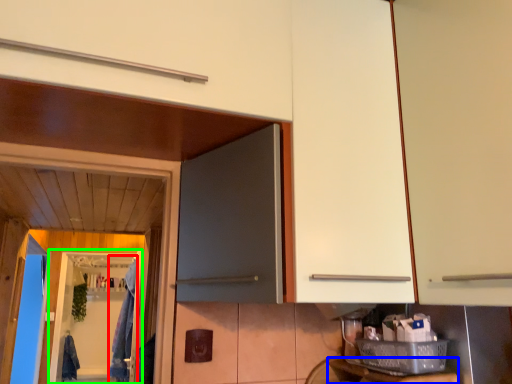
Question: Based on their relative distances, which object is farther from laundry (highlighted by a red box)? Choose from counter top (highlighted by a blue box) and screen door (highlighted by a green box).

Choices:
 (A) counter top
 (B) screen door

Answer: (A)